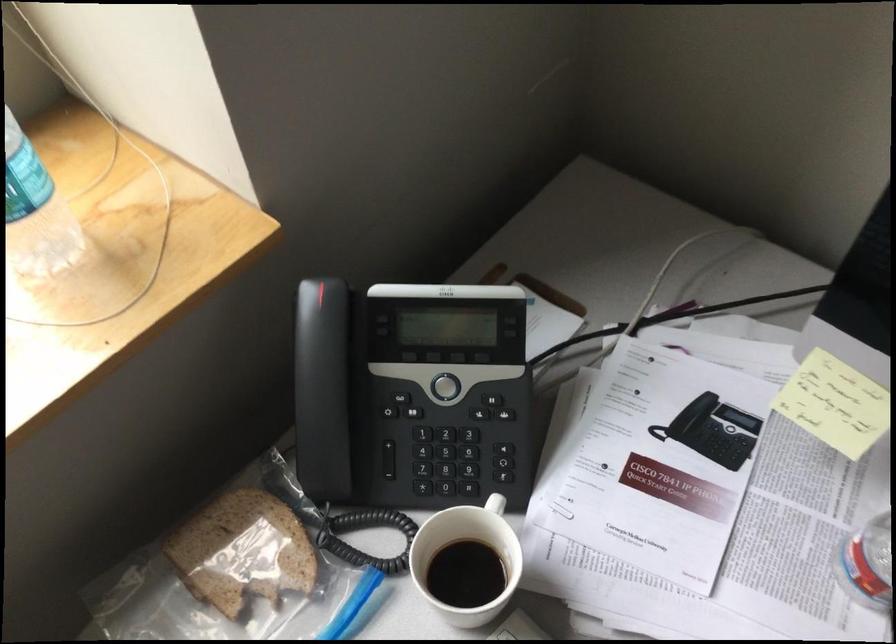
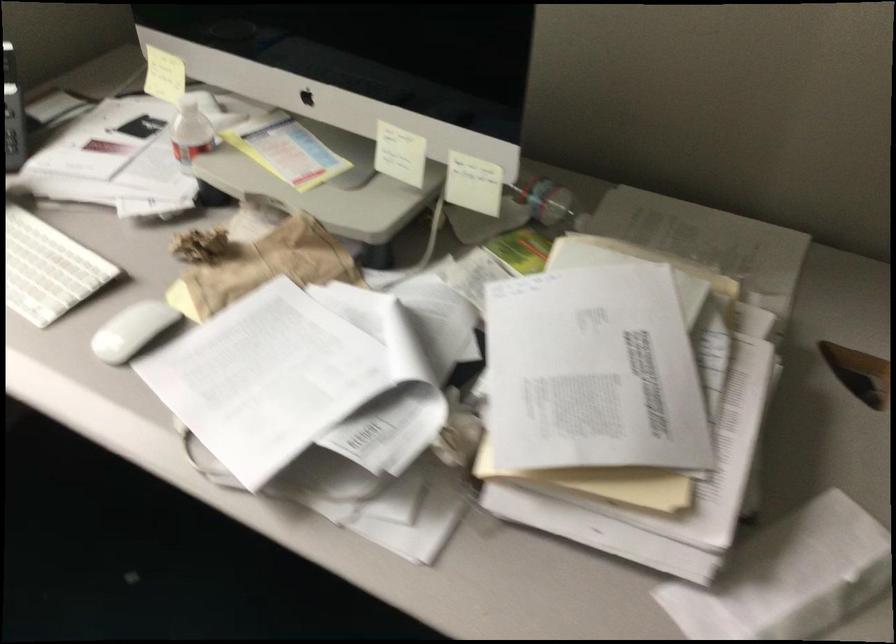
The images are taken continuously from a first-person perspective. In which direction are you moving?

The cameraman moved toward right, backward.